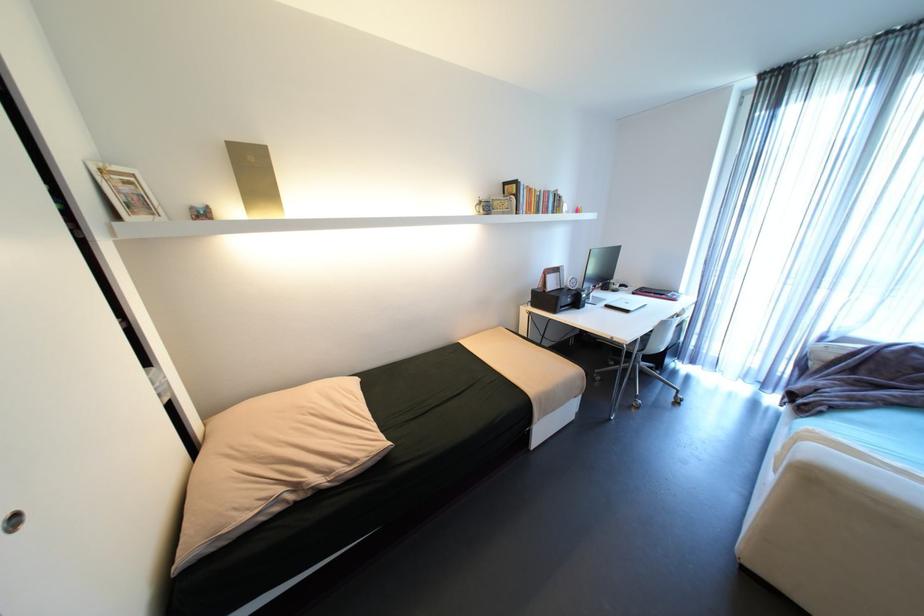
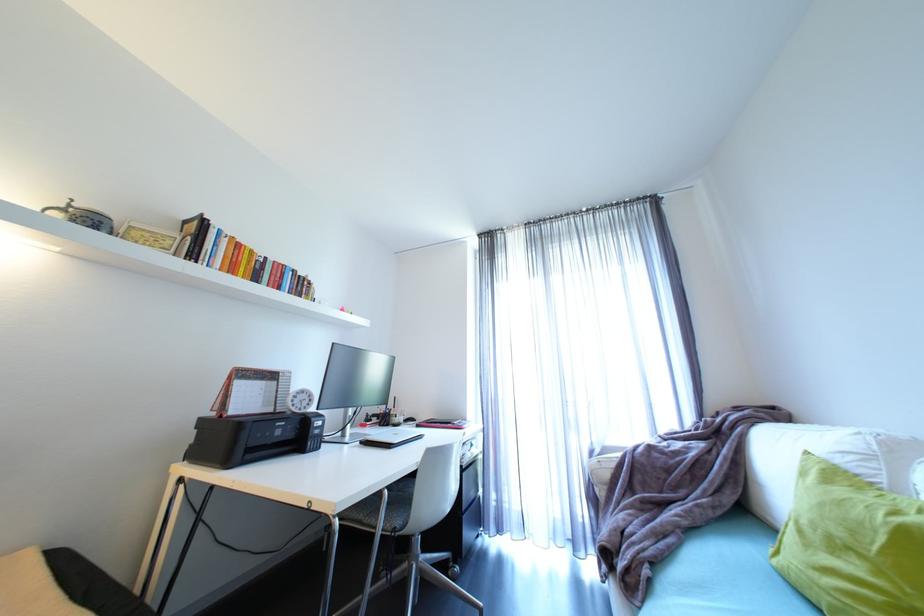
The point at (x=581, y=284) is marked in the first image. Where is the corresponding point in the second image?

(312, 402)